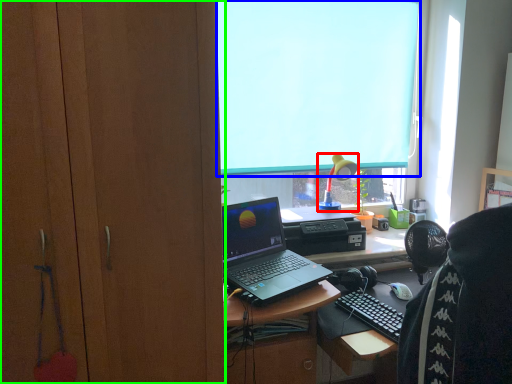
Question: Based on their relative distances, which object is nearer to lamp (highlighted by a red box)? Choose from window screen (highlighted by a blue box) and cabinetry (highlighted by a green box).

Choices:
 (A) window screen
 (B) cabinetry

Answer: (A)